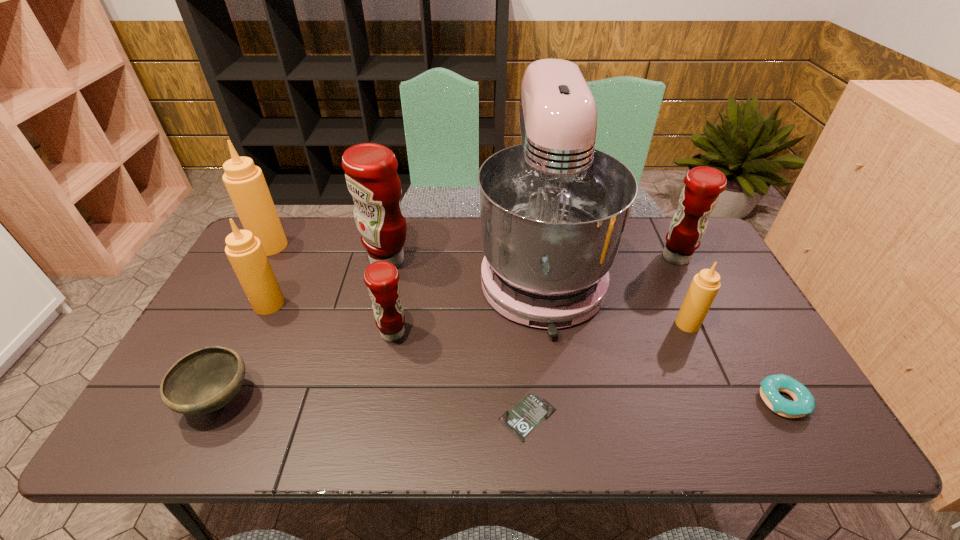
Image resolution: width=960 pixels, height=540 pixels. I want to click on tan condiment that is the closest to the second smallest tan condiment, so 245,183.

This screenshot has height=540, width=960. I want to click on red condiment object that ranks as the second closest to the farthest tan condiment, so click(x=381, y=277).

Select which red condiment appears as the third closest to the doughnut. Please provide its 2D coordinates. Your answer should be formatted as a tuple, i.e. [(x, y)], where the tuple contains the x and y coordinates of a point satisfying the conditions above.

[(371, 175)]

At what (x,y) coordinates should I click in order to perform the action: click on vacant space that satisfies the following two spatial constraints: 1. on the back side of the second smallest red condiment; 2. on the right side of the biggest red condiment. Please return your answer as a coordinate pair (x, y). The image size is (960, 540). Looking at the image, I should click on (388, 257).